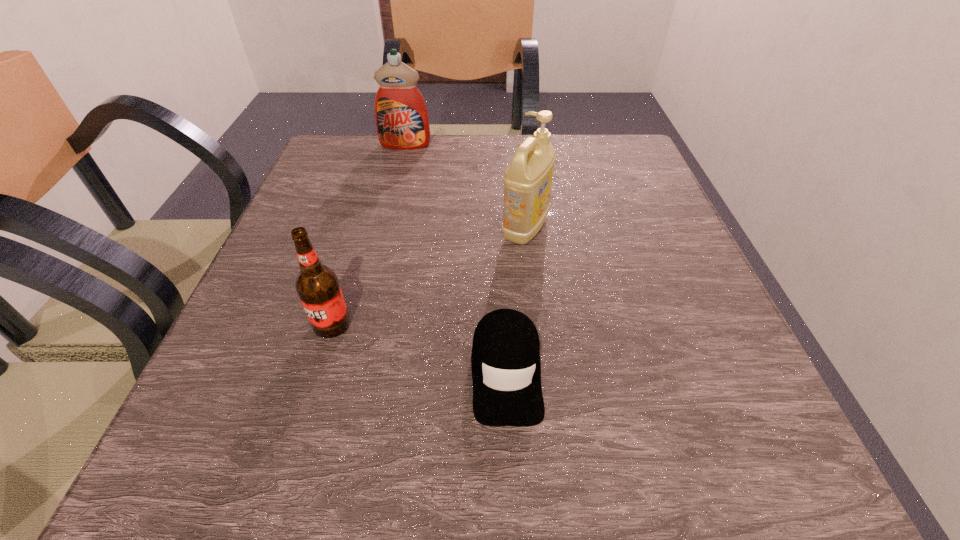
You are a GUI agent. You are given a task and a screenshot of the screen. Output one action in this format:
    pyautogui.click(x=<x>, y=<y>)
    Task: Click on the free space between the third nearest object and the root beer
    The height and width of the screenshot is (540, 960).
    Given the screenshot: What is the action you would take?
    pyautogui.click(x=428, y=276)

What are the coordinates of `object that ranks as the closest to the cap` in the screenshot? It's located at (527, 180).

What are the coordinates of `object that is the second closest to the cap` in the screenshot? It's located at (317, 285).

The image size is (960, 540). In order to click on blank space that satisfies the following two spatial constraints: 1. on the front surface of the farther detergent; 2. on the left side of the right detergent in this screenshot , I will do `click(385, 229)`.

This screenshot has width=960, height=540. What are the coordinates of `free spot that satisfies the following two spatial constraints: 1. on the back side of the third nearest object; 2. on the right side of the root beer` in the screenshot? It's located at (361, 229).

The width and height of the screenshot is (960, 540). I want to click on free space that satisfies the following two spatial constraints: 1. on the front surface of the nearer detergent; 2. on the left side of the farther detergent, so click(x=385, y=229).